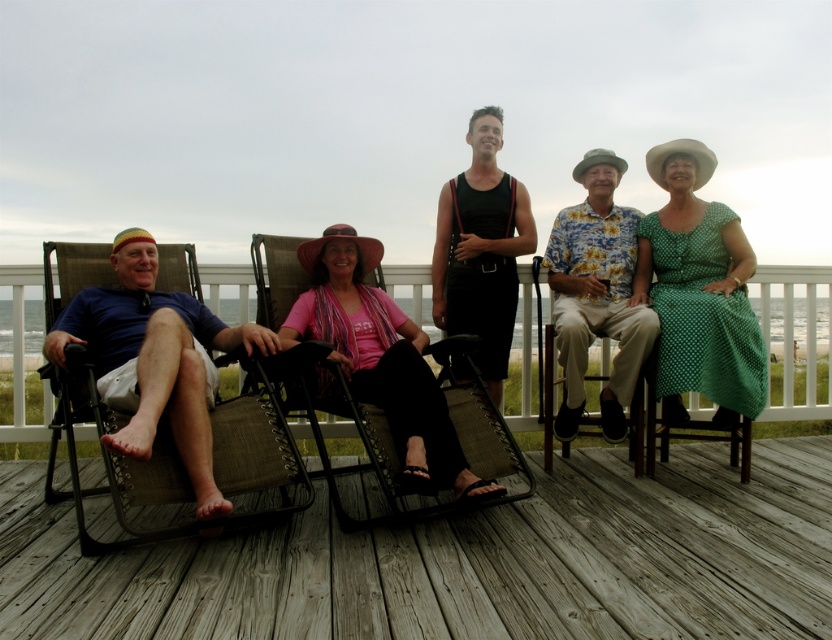
You are a photographer trying to capture a group photo of the floral shirt at center and the black fabric dress at center. If you want to ensure both subjects are fully visible in the frame, which subject should you position closer to the camera to avoid cropping?

The floral shirt at center should be positioned closer to the camera because it has a smaller width than the black fabric dress at center, allowing it to fit better in the frame without cropping.

You are a photographer trying to capture a group photo of the people on the deck. You need to arrange them so that the green dotted dress at right and the pink fabric dress at center are visible. Based on their current positions, which dress is located to the right of the other?

The green dotted dress at right is positioned on the right side of the pink fabric dress at center.